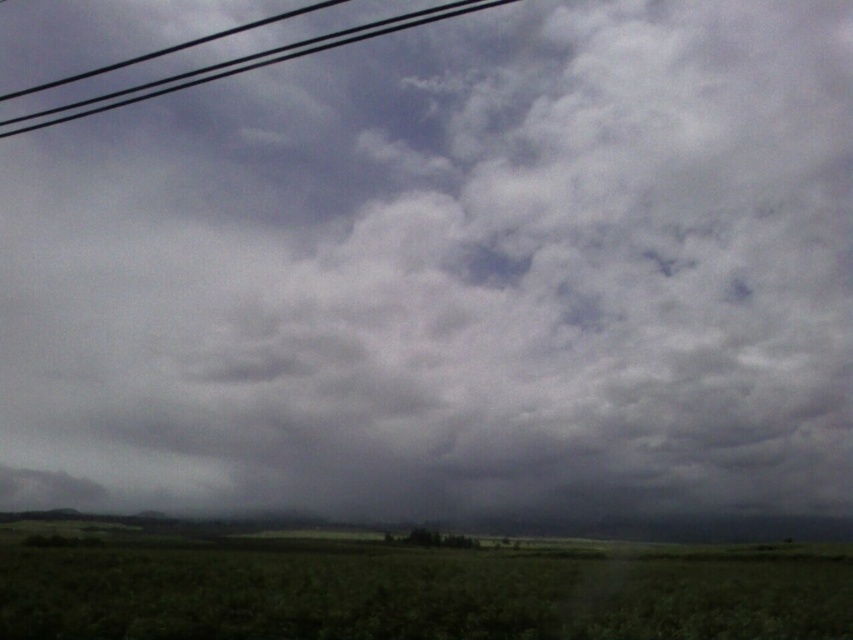
Who is positioned more to the left, green grass at lower center or black wire at upper left?

black wire at upper left

Who is lower down, green grass at lower center or black wire at upper left?

green grass at lower center

Where is `green grass at lower center`? green grass at lower center is located at coordinates (410, 588).